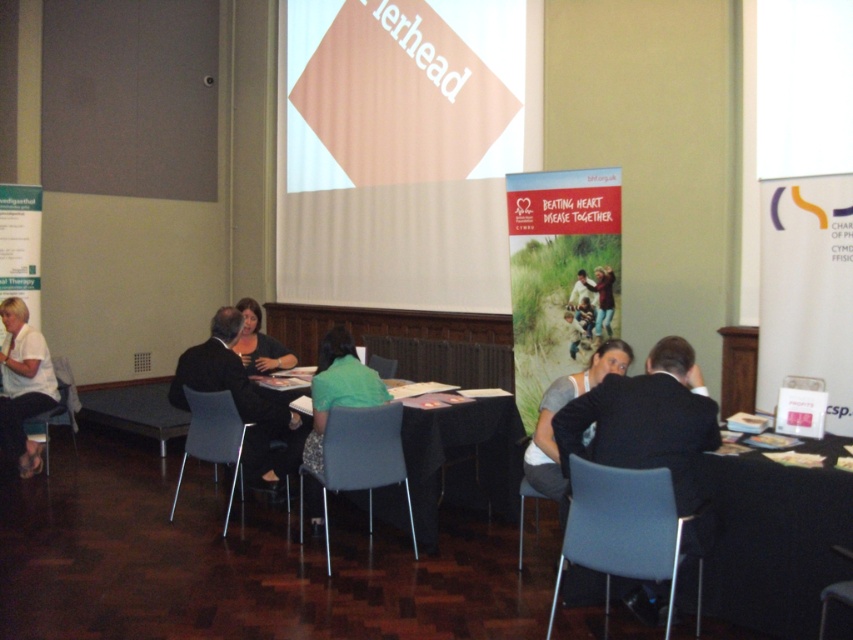
Which of these two, green fabric shirt at center or metallic silver chair at lower left, stands taller?

green fabric shirt at center

Does point (310, 515) lie behind point (74, 426)?

No, it is not.

Between point (370, 401) and point (74, 401), which one is positioned behind?

Point (74, 401)

This screenshot has height=640, width=853. Find the location of `green fabric shirt at center`. green fabric shirt at center is located at coordinates (338, 388).

Does white cotton shirt at center appear on the left side of green fabric jacket at center?

Yes, white cotton shirt at center is to the left of green fabric jacket at center.

Is point (535, 454) closer to viewer compared to point (604, 289)?

Yes, point (535, 454) is closer to viewer.

I want to click on white cotton shirt at center, so point(556,410).

Can you confirm if matte gray chair at center is thinner than metallic gray chair at center?

In fact, matte gray chair at center might be wider than metallic gray chair at center.

Describe the element at coordinates (358, 460) in the screenshot. I see `matte gray chair at center` at that location.

At what (x,y) coordinates should I click in order to perform the action: click on matte gray chair at center. Please return your answer as a coordinate pair (x, y). Image resolution: width=853 pixels, height=640 pixels. Looking at the image, I should click on (358, 460).